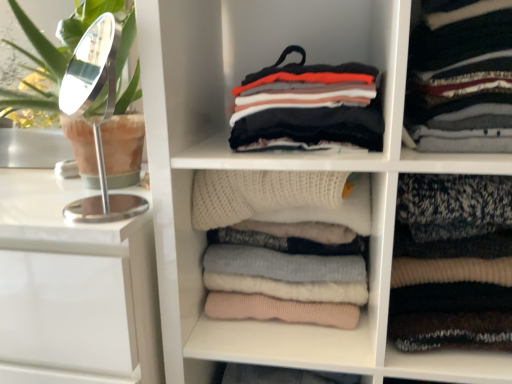
Question: Considering the positions of striped knit sweater at upper right, which is the 2th clothing from left to right, and white knitted sweater at center in the image, is striped knit sweater at upper right, which is the 2th clothing from left to right, wider or thinner than white knitted sweater at center?

Choices:
 (A) wide
 (B) thin

Answer: (A)

Question: Does point (500, 8) appear closer or farther from the camera than point (238, 337)?

Choices:
 (A) closer
 (B) farther

Answer: (A)

Question: Estimate the real-world distances between objects in this image. Which object is closer to the striped knit sweater at upper right, which is the 2th clothing from left to right?

Choices:
 (A) white knitted sweater at center
 (B) multicolored knitted sweater at center, positioned as the first clothing in left-to-right order
 (C) white glossy vanity at left
 (D) knit sweater at center
 (E) knitted wool sweater at right, the 1th clothing in the right-to-left sequence

Answer: (B)

Question: Based on their relative distances, which object is farther from the knitted wool sweater at right, the 1th clothing in the right-to-left sequence?

Choices:
 (A) knit sweater at center
 (B) striped knit sweater at upper right, which is the 2th clothing from left to right
 (C) white glossy vanity at left
 (D) multicolored knitted sweater at center, positioned as the first clothing in left-to-right order
 (E) white knitted sweater at center

Answer: (C)